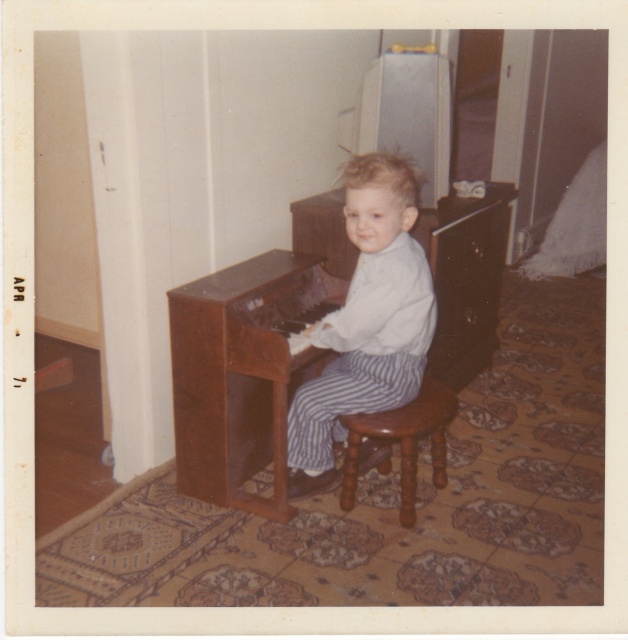
Is point (230, 365) more distant than point (349, 492)?

No.

What do you see at coordinates (241, 372) in the screenshot? The width and height of the screenshot is (628, 640). I see `wooden piano at center` at bounding box center [241, 372].

Describe the element at coordinates (241, 372) in the screenshot. This screenshot has height=640, width=628. I see `wooden piano at center` at that location.

Locate an element on the screen. Image resolution: width=628 pixels, height=640 pixels. wooden piano at center is located at coordinates (241, 372).

Is white striped pants at center shorter than brown wooden stool at center?

Incorrect, white striped pants at center's height does not fall short of brown wooden stool at center's.

Is white striped pants at center closer to the viewer compared to brown wooden stool at center?

Yes, it is.

Where is `white striped pants at center`? white striped pants at center is located at coordinates (365, 321).

Is point (301, 371) farther from camera compared to point (399, 356)?

That is True.

Measure the distance between point (214, 365) and camera.

They are 7.17 feet apart.

Does point (261, 426) lie in front of point (369, 269)?

No, it is behind (369, 269).

Locate an element on the screen. The image size is (628, 640). wooden piano at center is located at coordinates (241, 372).